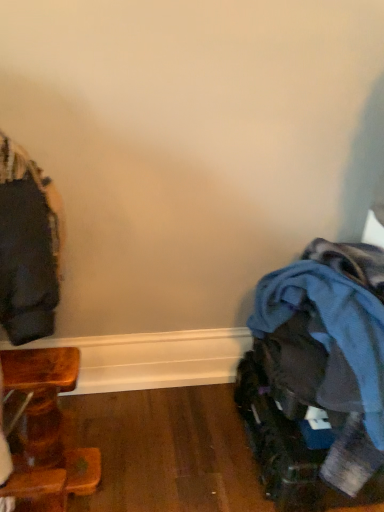
At what (x,y) coordinates should I click in order to perform the action: click on dark blue fabric baby carriage at lower right. Please return your answer as a coordinate pair (x, y). Looking at the image, I should click on (317, 376).

This screenshot has width=384, height=512. Describe the element at coordinates (317, 376) in the screenshot. I see `dark blue fabric baby carriage at lower right` at that location.

I want to click on dark blue fabric baby carriage at lower right, so click(317, 376).